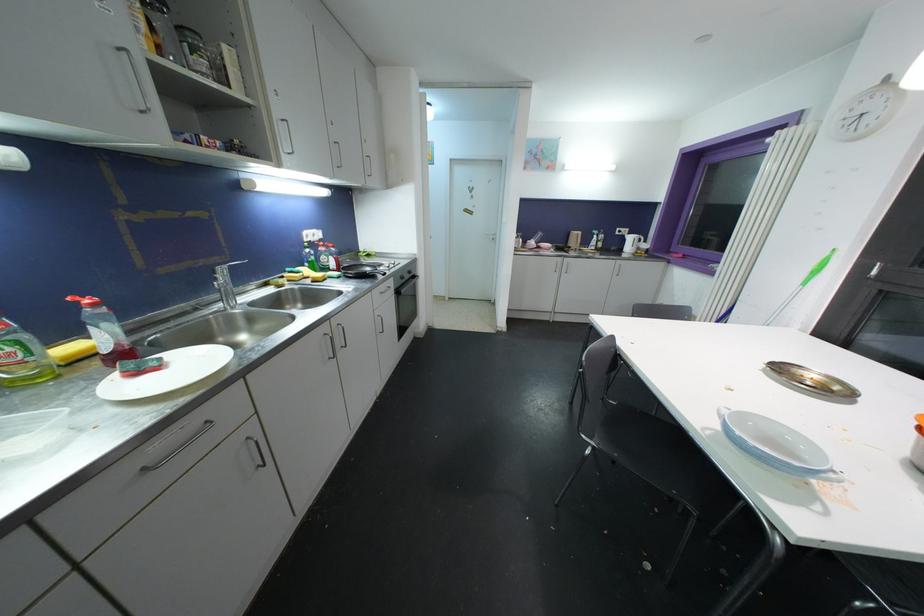
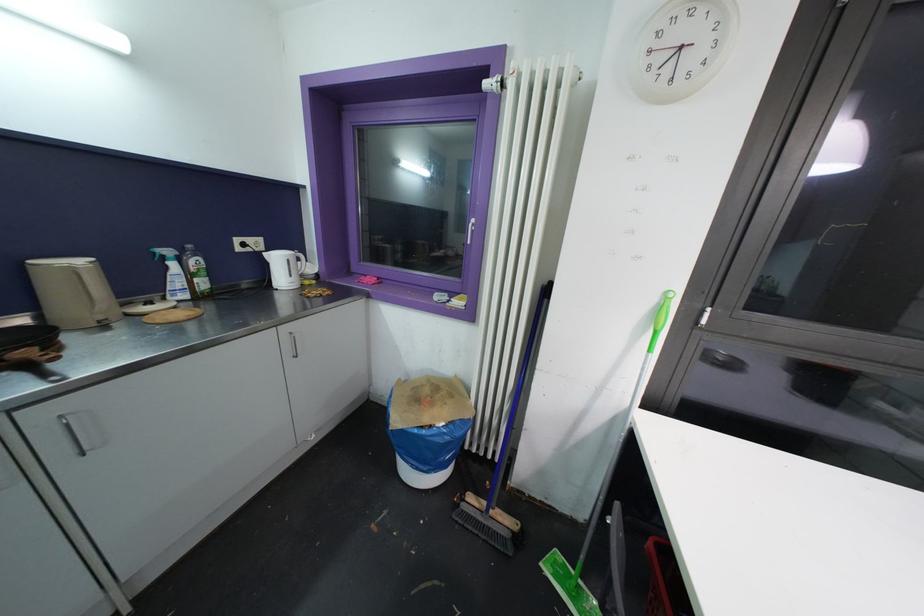
In the second image, find the point that corresponds to the point at 599,235 in the first image.

(171, 254)